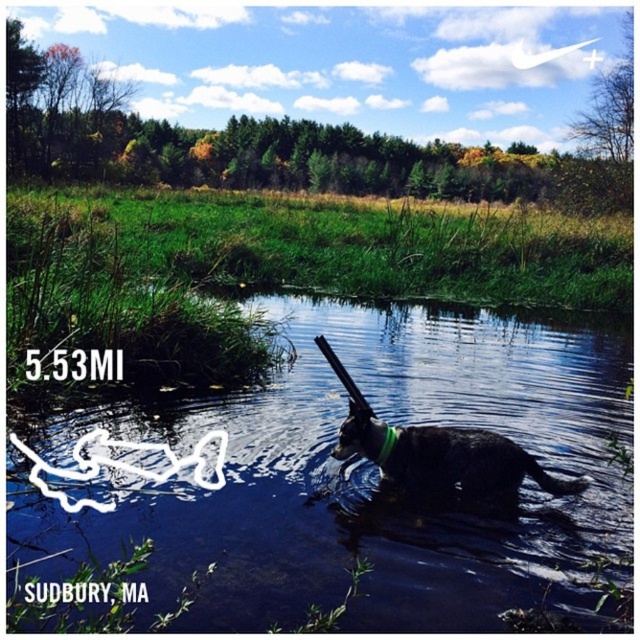
Question: Does black glossy water at lower center have a lesser width compared to black matte dog at center?

Choices:
 (A) yes
 (B) no

Answer: (B)

Question: Which of the following is the closest to the observer?

Choices:
 (A) (259, 419)
 (B) (490, 476)
 (C) (388, 438)

Answer: (B)

Question: Which point appears farthest from the camera in this image?

Choices:
 (A) (394, 436)
 (B) (554, 337)

Answer: (B)

Question: Is black glossy water at lower center above black matte dog at center?

Choices:
 (A) yes
 (B) no

Answer: (A)

Question: Which point is closer to the camera?

Choices:
 (A) black glossy water at lower center
 (B) green fabric neckband at center

Answer: (A)

Question: Does black glossy water at lower center have a lesser width compared to green fabric neckband at center?

Choices:
 (A) yes
 (B) no

Answer: (B)